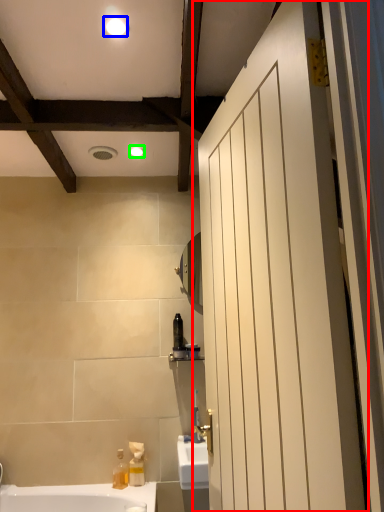
Question: Which object is positioned farthest from door (highlighted by a red box)? Select from light fixture (highlighted by a blue box) and light fixture (highlighted by a green box).

Choices:
 (A) light fixture
 (B) light fixture

Answer: (B)